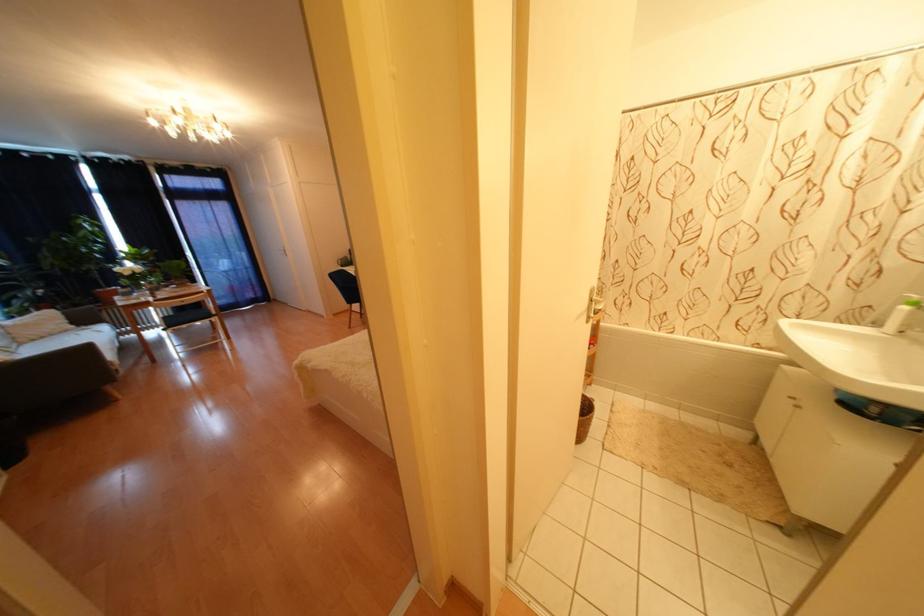
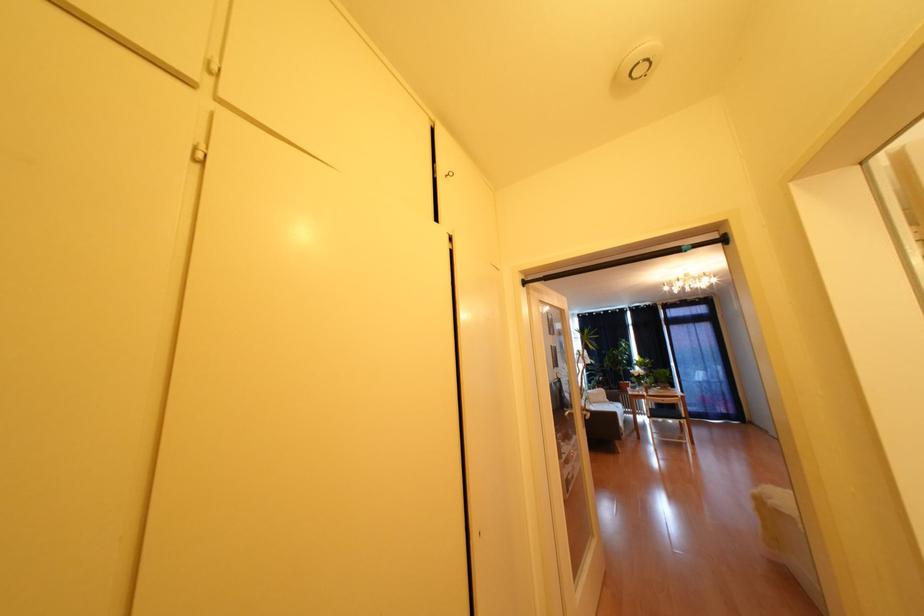
Question: The images are taken continuously from a first-person perspective. In which direction is your viewpoint rotating?

Choices:
 (A) Left
 (B) Right
 (C) Up
 (D) Down

Answer: (A)